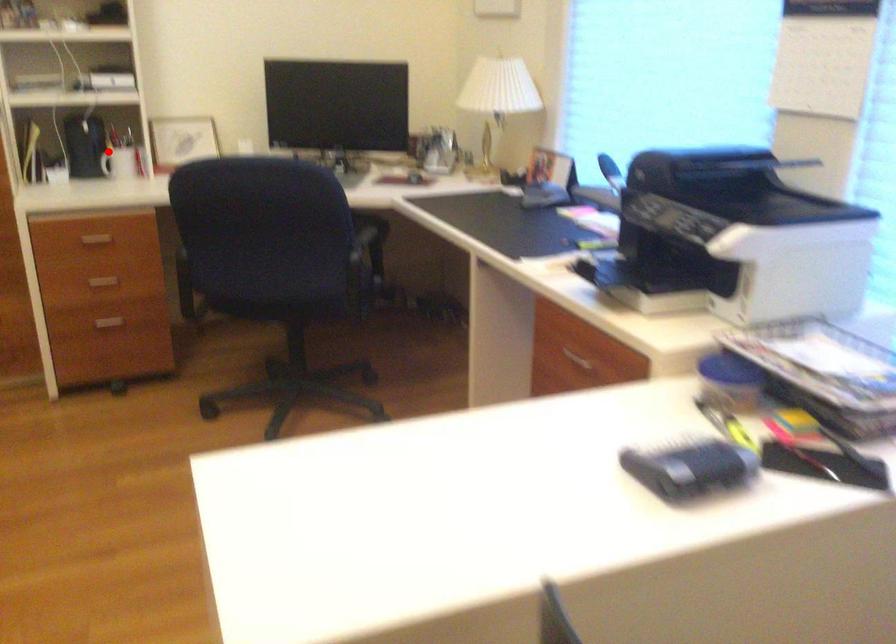
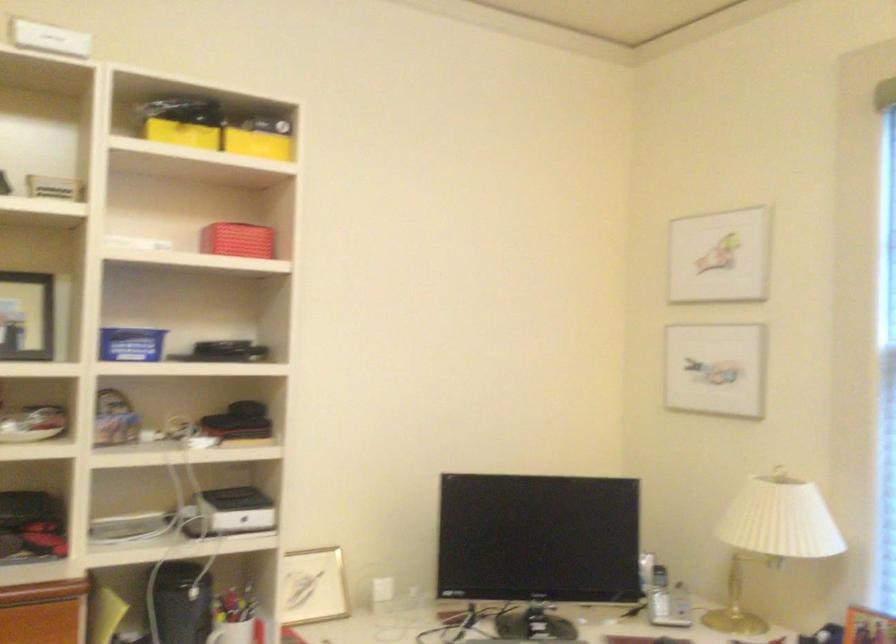
Locate, in the second image, the point that corresponds to the highlighted location in the first image.

(231, 632)